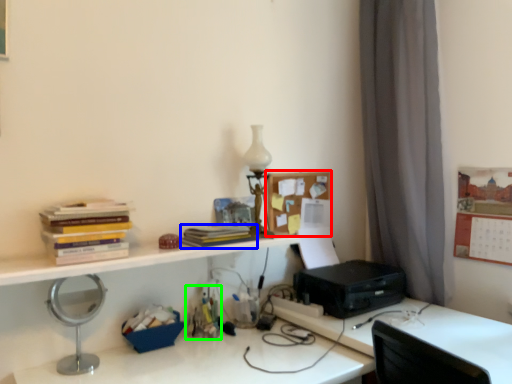
Question: Estimate the real-world distances between objects in this image. Which object is closer to shelf (highlighted by a red box), paperback book (highlighted by a blue box) or stationery (highlighted by a green box)?

Choices:
 (A) paperback book
 (B) stationery

Answer: (A)